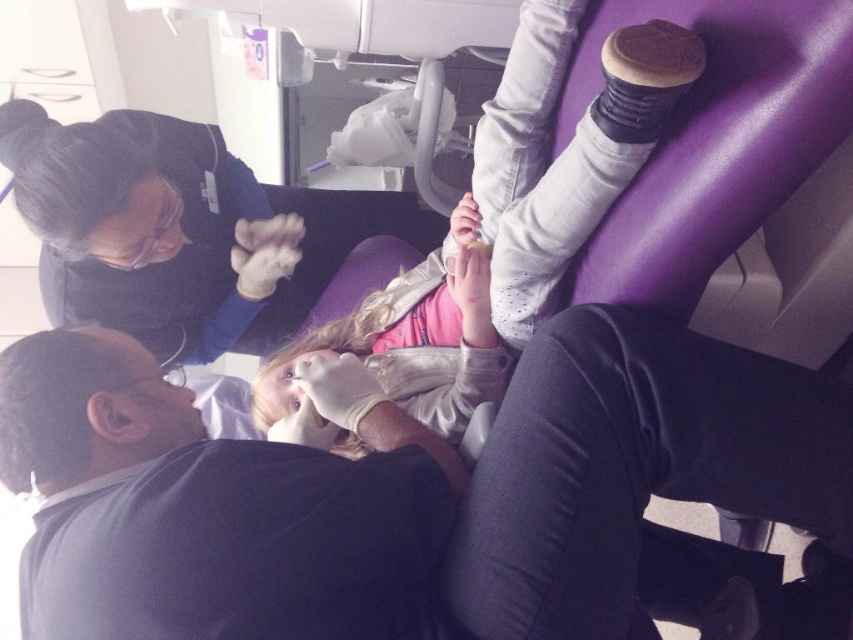
You are a patient entering the dental office and see the dark gray shirt at upper left and the light pink fabric at center. Which piece of clothing appears smaller in size?

The dark gray shirt at upper left is smaller than the light pink fabric at center.

You are a dental assistant who needs to hand a tool to the dentist. The dentist is wearing a dark gray shirt at upper left. The tool is currently on a tray placed between the dental chair and the wall. Can you reach the dentist by moving straight forward from the tool without stepping over any obstacles?

The dark gray shirt at upper left is 72.73 centimeters away from the tool. Since the distance is more than arm length, you cannot reach the dentist by moving straight forward from the tool without stepping over any obstacles.

You are a patient entering the dental office and see the dark gray shirt at upper left and the light pink fabric at center. Which object is positioned higher in the image?

The light pink fabric at center is positioned higher in the image than the dark gray shirt at upper left.